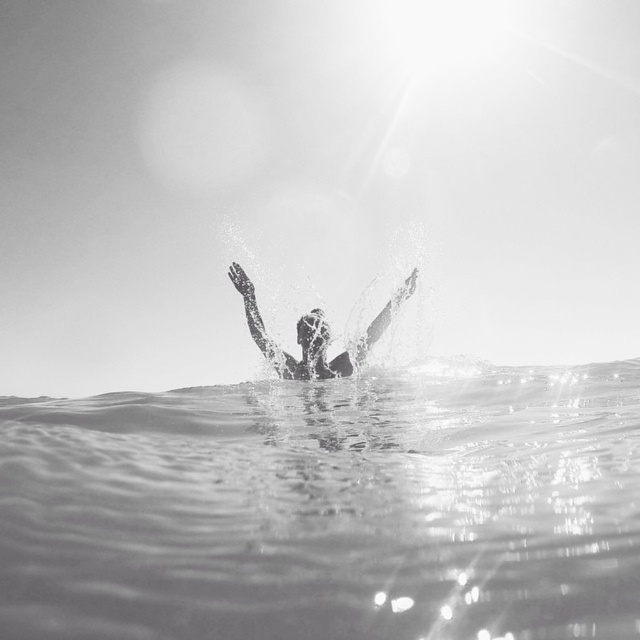
What is the exact coordinate of the clear water at center in the image?

The clear water at center is located at point (x=326, y=508).

Based on the scene described, which object is positioned lower in the image between the clear water at center and the silhouette smooth skin at center?

The clear water at center is positioned lower than the silhouette smooth skin at center because the clear water at center is shorter than silhouette smooth skin at center.

You are a photographer analyzing this image. You need to determine which object occupies more horizontal space in the frame between the clear water at center and the silhouette smooth skin at center. Which one is wider?

The silhouette smooth skin at center has a greater width than the clear water at center, so the silhouette smooth skin at center occupies more horizontal space in the frame.